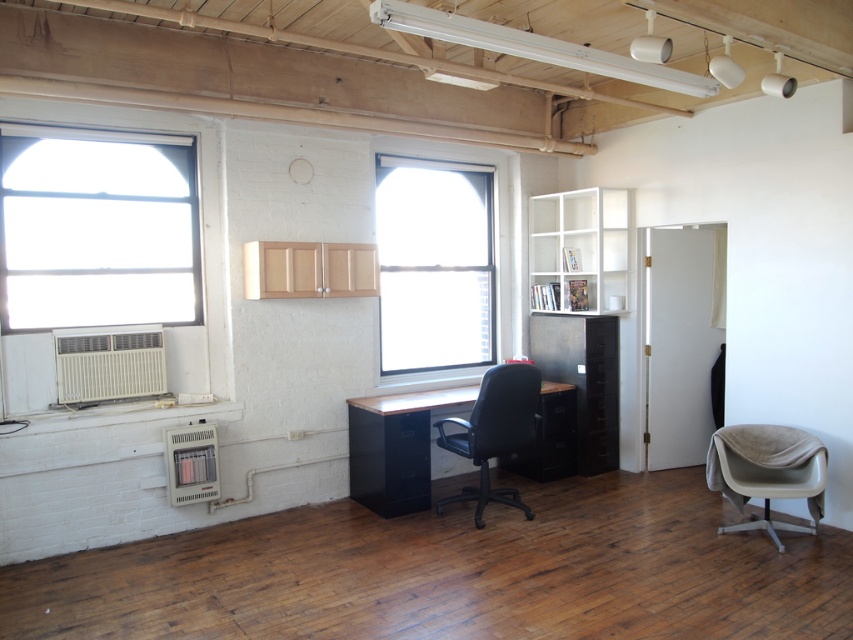
Is clear glass window at upper left wider than matte wood desk at center?

Incorrect, clear glass window at upper left's width does not surpass matte wood desk at center's.

Between point (171, 193) and point (428, 492), which one is positioned behind?

The point (428, 492) is more distant.

Identify the location of clear glass window at upper left. (97, 230).

Is clear glass window at upper left smaller than black leather office chair at center?

No, clear glass window at upper left is not smaller than black leather office chair at center.

Which is more to the right, clear glass window at upper left or black leather office chair at center?

black leather office chair at center

Identify the location of clear glass window at upper left. (97, 230).

Identify the location of clear glass window at upper left. (97, 230).

Who is shorter, clear glass window at center or matte wood desk at center?

matte wood desk at center

Is clear glass window at center closer to camera compared to matte wood desk at center?

No, it is not.

Is point (473, 300) closer to viewer compared to point (358, 413)?

No.

I want to click on clear glass window at center, so click(x=434, y=264).